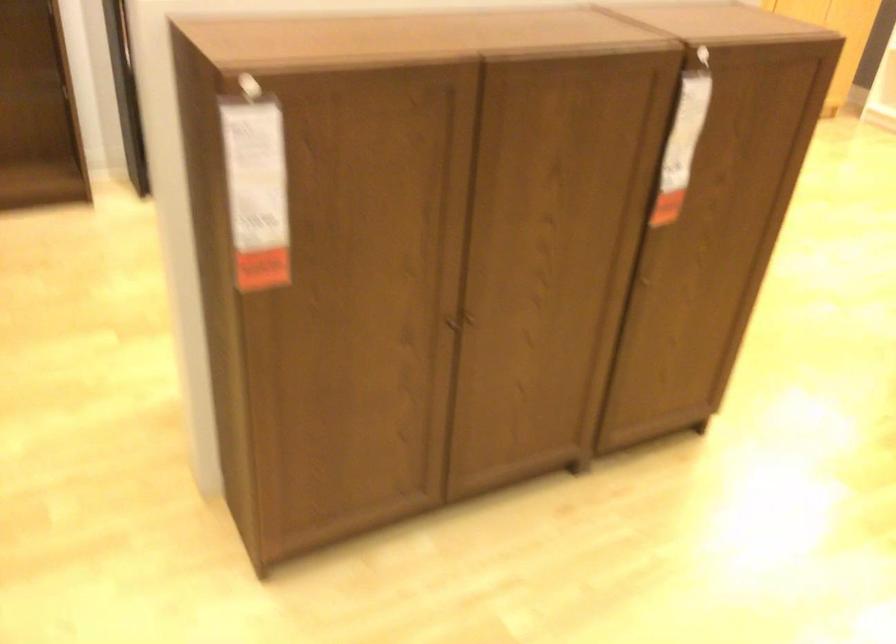
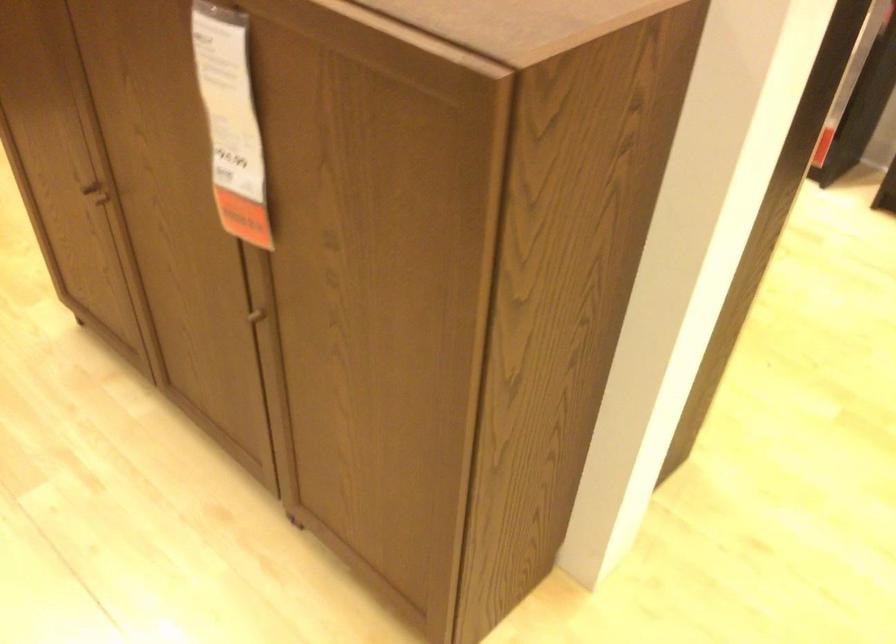
In the second image, find the point that corresponds to (x=443, y=328) in the first image.

(95, 196)